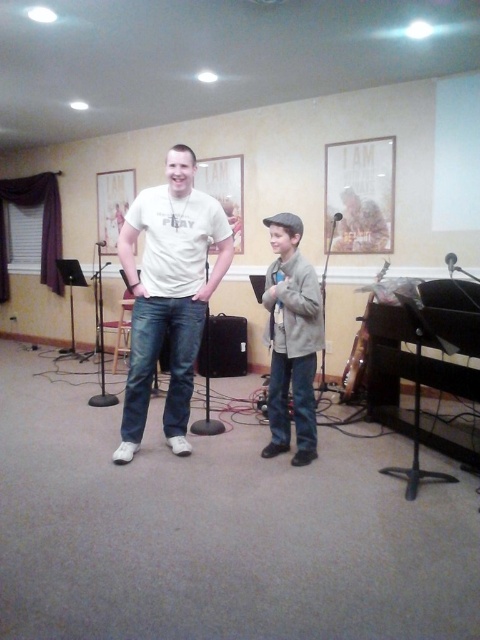
Does white matte t-shirt at center have a larger size compared to light brown leather jacket at center?

Correct, white matte t-shirt at center is larger in size than light brown leather jacket at center.

Does white matte t-shirt at center appear over light brown leather jacket at center?

Correct, white matte t-shirt at center is located above light brown leather jacket at center.

What do you see at coordinates (168, 294) in the screenshot? I see `white matte t-shirt at center` at bounding box center [168, 294].

Image resolution: width=480 pixels, height=640 pixels. Identify the location of white matte t-shirt at center. pos(168,294).

Consider the image. Is light brown leather jacket at center below black matte microphone at center?

Yes.

From the picture: Does light brown leather jacket at center appear on the right side of black matte microphone at center?

Indeed, light brown leather jacket at center is positioned on the right side of black matte microphone at center.

Is point (271, 268) positioned behind point (105, 241)?

No, it is in front of (105, 241).

Where is `light brown leather jacket at center`? This screenshot has width=480, height=640. light brown leather jacket at center is located at coordinates (291, 339).

Is point (271, 285) farther from camera compared to point (213, 320)?

No, it is not.

Is light brown leather jacket at center to the left of black plastic speaker at center from the viewer's perspective?

Incorrect, light brown leather jacket at center is not on the left side of black plastic speaker at center.

Find the location of `light brown leather jacket at center`. light brown leather jacket at center is located at coordinates pyautogui.click(x=291, y=339).